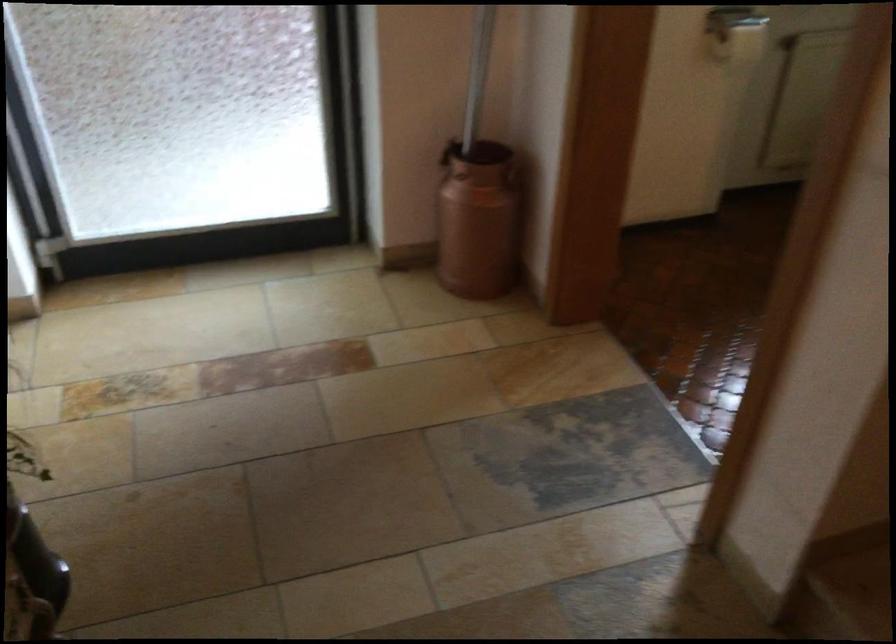
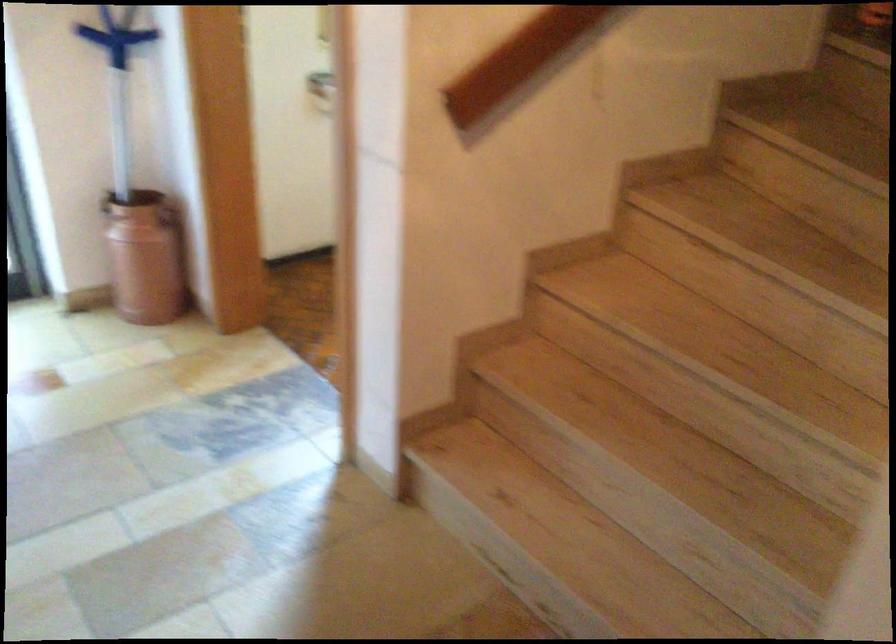
Where in the second image is the point corresponding to the point at 442,151 from the first image?

(105, 202)